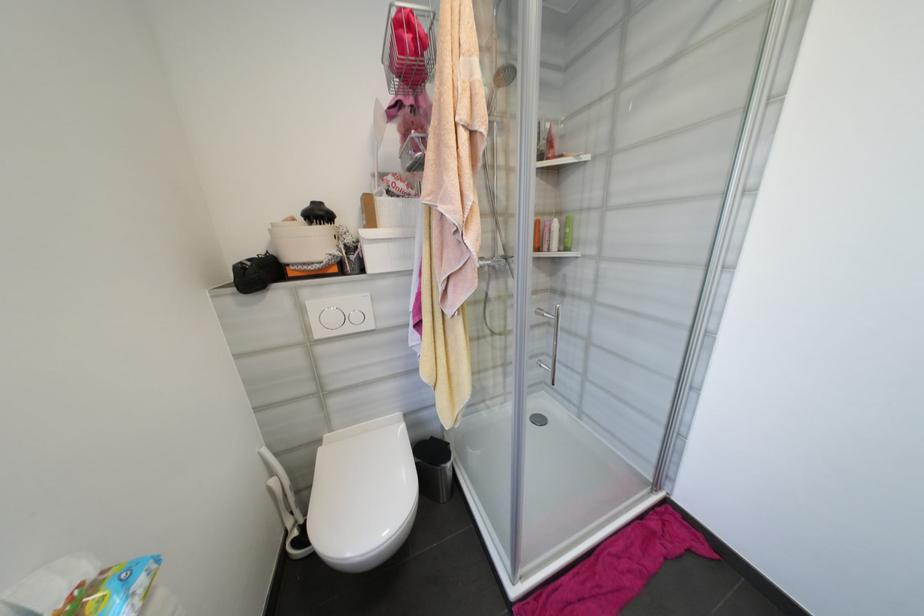
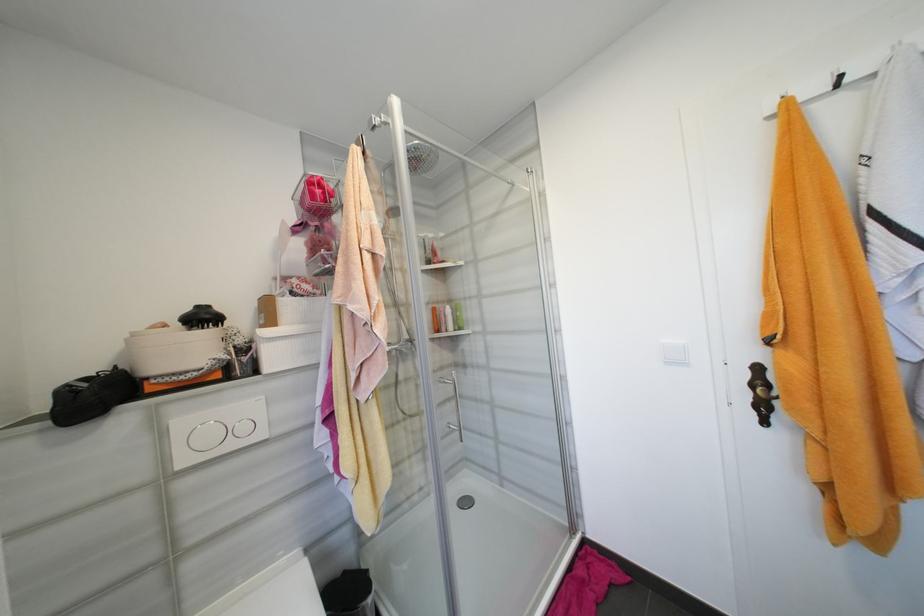
In the second image, find the point that corresponds to the point at 280,225 in the first image.

(140, 334)